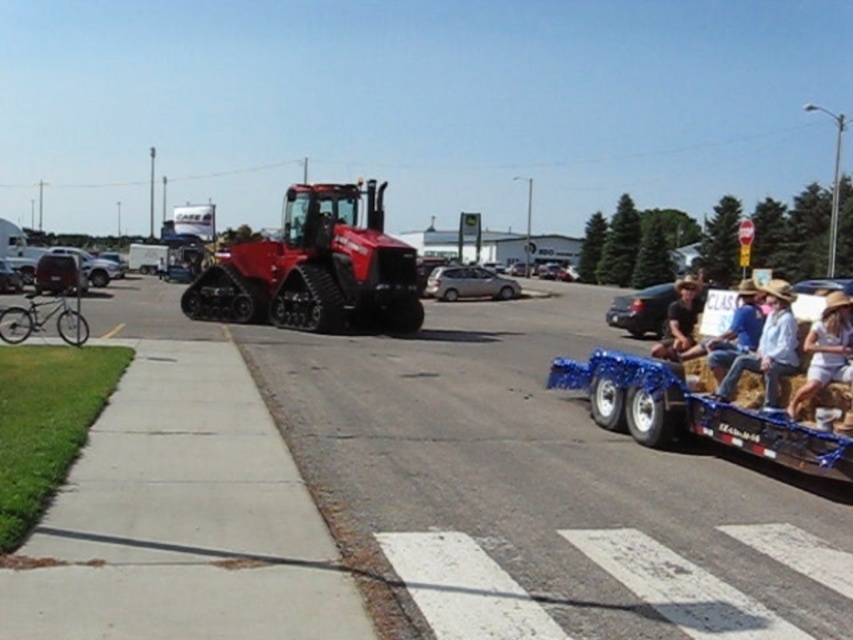
Question: Can you confirm if matte black car at right is smaller than blue denim shirt at right?

Choices:
 (A) no
 (B) yes

Answer: (B)

Question: Estimate the real-world distances between objects in this image. Which object is farther from the denim jacket at center?

Choices:
 (A) matte black car at center
 (B) white cotton dress at lower right

Answer: (A)

Question: Estimate the real-world distances between objects in this image. Which object is farther from the brown leather hat at center?

Choices:
 (A) silver metallic minivan at center
 (B) matte black car at right
 (C) brushed metal bicycle at left

Answer: (C)

Question: In this image, where is white cotton dress at lower right located relative to blue denim shirt at right?

Choices:
 (A) below
 (B) above

Answer: (A)

Question: In this image, where is brown leather hat at center located relative to matte black car at center?

Choices:
 (A) right
 (B) left

Answer: (A)

Question: Which point is farther to the camera?

Choices:
 (A) matte black car at center
 (B) blue metallic wagon at lower right

Answer: (A)